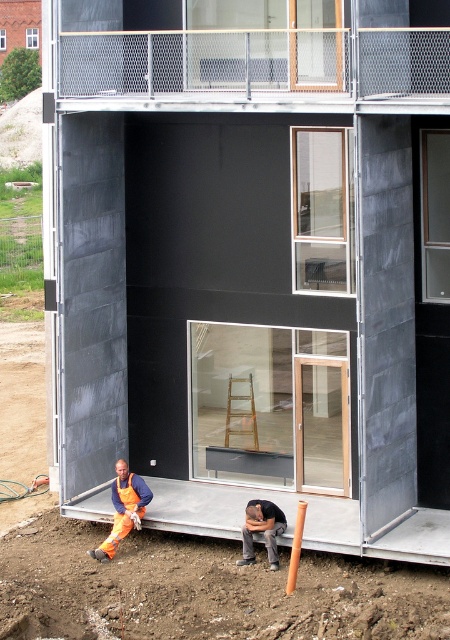
Question: Among these points, which one is nearest to the camera?

Choices:
 (A) (131, 477)
 (B) (100, 556)

Answer: (B)

Question: Which point is farther from the camera taking this photo?

Choices:
 (A) click(x=268, y=525)
 (B) click(x=147, y=492)

Answer: (B)

Question: Is dark gray fabric pants at lower center positioned behind orange fabric safety vest at lower left?

Choices:
 (A) no
 (B) yes

Answer: (A)

Question: Can you confirm if orange coveralls at lower left is thinner than dark gray fabric pants at lower center?

Choices:
 (A) no
 (B) yes

Answer: (A)

Question: Is orange coveralls at lower left further to camera compared to orange fabric safety vest at lower left?

Choices:
 (A) no
 (B) yes

Answer: (A)

Question: Which of the following is the closest to the observer?

Choices:
 (A) click(x=125, y=493)
 (B) click(x=248, y=516)

Answer: (B)